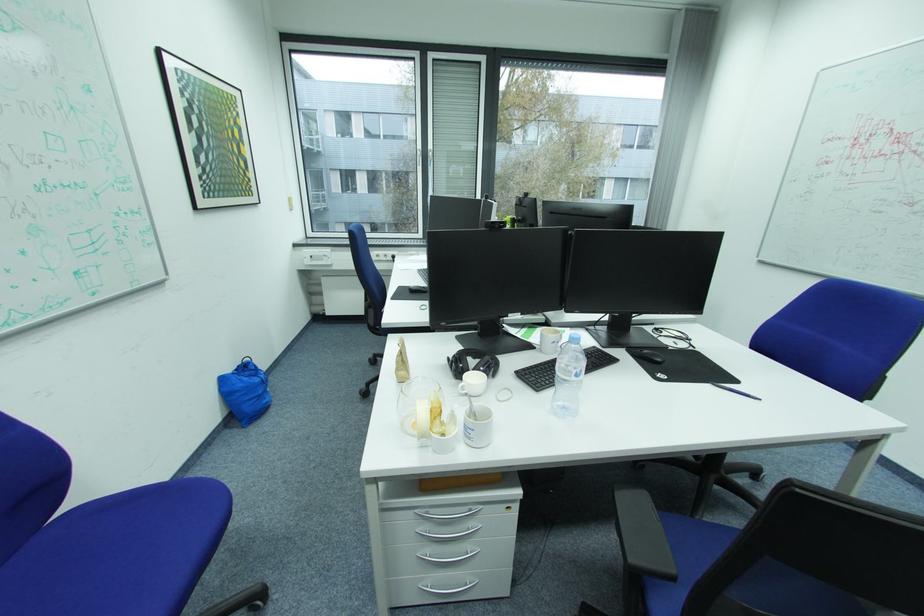
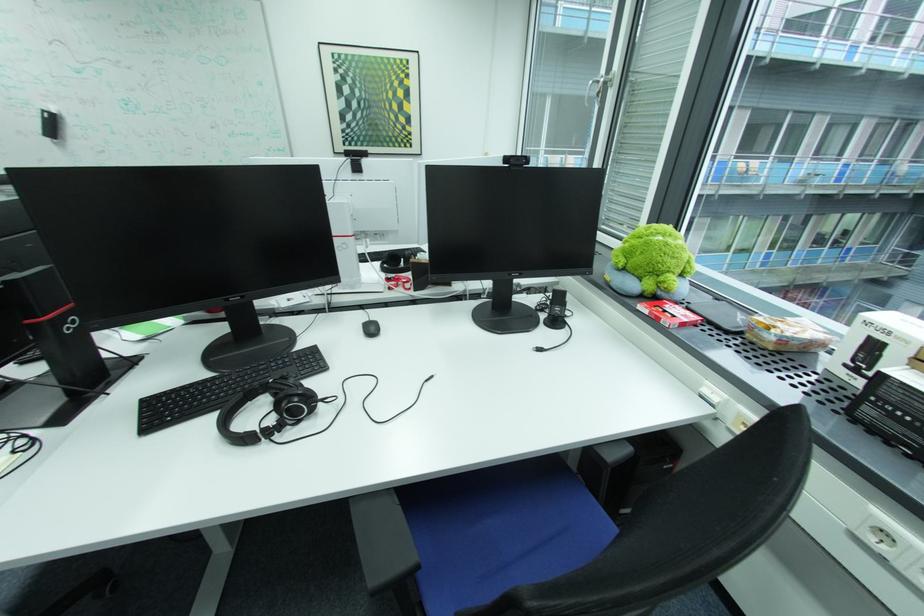
Locate, in the second image, the point that corresponds to the point at 204,209 in the first image.

(344, 153)